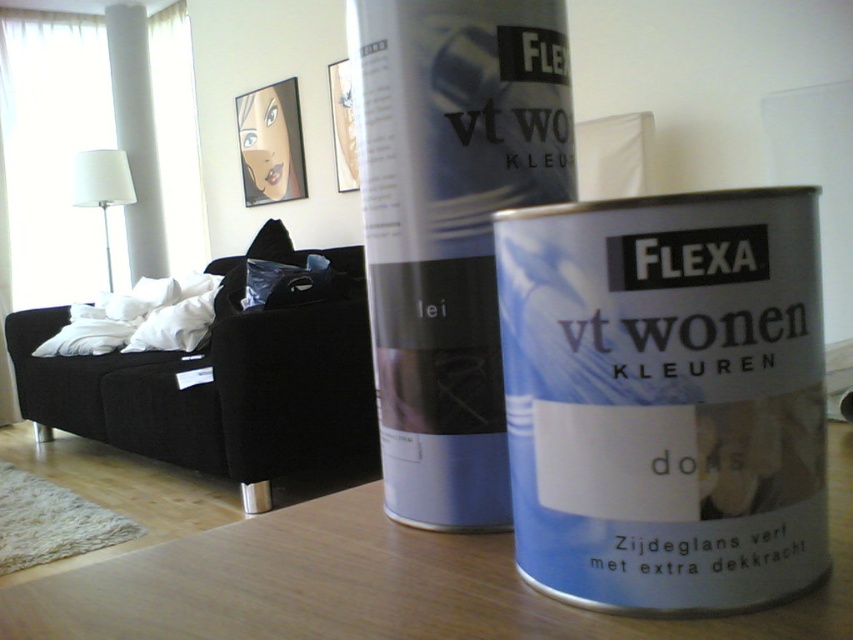
Consider the image. You are an interior designer who needs to choose between the two paint cans in the living room scene. The satin white paint can at center and the matte silver paint can at center. Which one is smaller in size?

The satin white paint can at center has a smaller size compared to the matte silver paint can at center, so the satin white paint can at center is the smaller one.

You are a painter standing 1 meter away from the matte silver paint can at center. Can you reach it without moving your feet?

The matte silver paint can at center is 47.92 centimeters away from the camera, so since you are standing 1 meter away, it is within reach without moving your feet.

You are standing in the living room and see two points marked in the scene. Which point is closer to you, point [718,193] or point [567,145]?

Point [718,193] is in front of point [567,145], so it is closer to you.